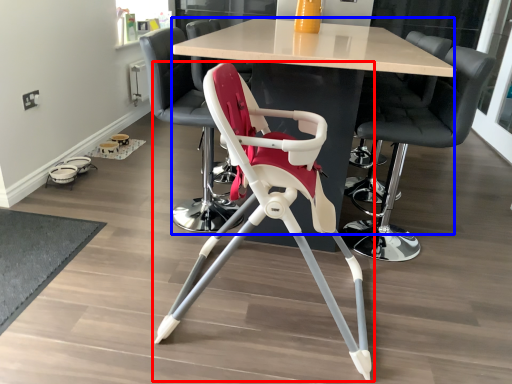
Question: Which of the following is the closest to the observer, chair (highlighted by a red box) or table (highlighted by a blue box)?

Choices:
 (A) chair
 (B) table

Answer: (A)